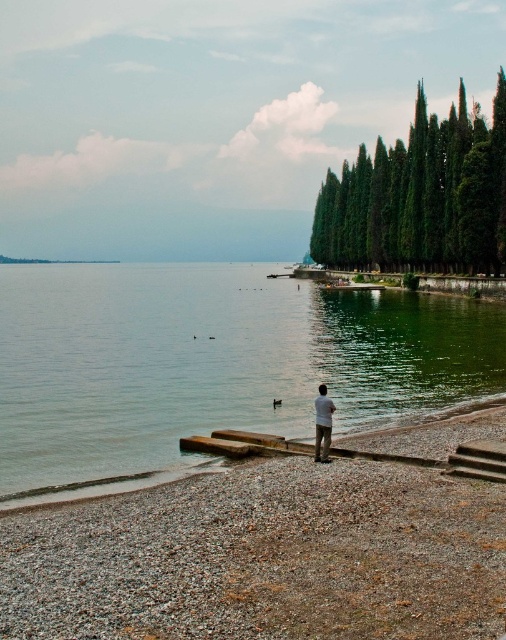
You are standing at the point labeled as point (214,364). What is the terrain like at your current location?

The terrain at point (214,364) is green smooth water at center.

You are standing at the edge of the lake and want to walk to the brown wooden dock at lower center. However, there is green smooth water at center in your way. Can you reach the dock without getting your feet wet?

The green smooth water at center is positioned over brown wooden dock at lower center, so the dock is submerged under the water. Therefore, you cannot reach the dock without getting your feet wet.

You are standing at the center of the image. Which direction should you walk to reach the green smooth water at center?

You are already at the green smooth water at center since it is located at the center of the image.